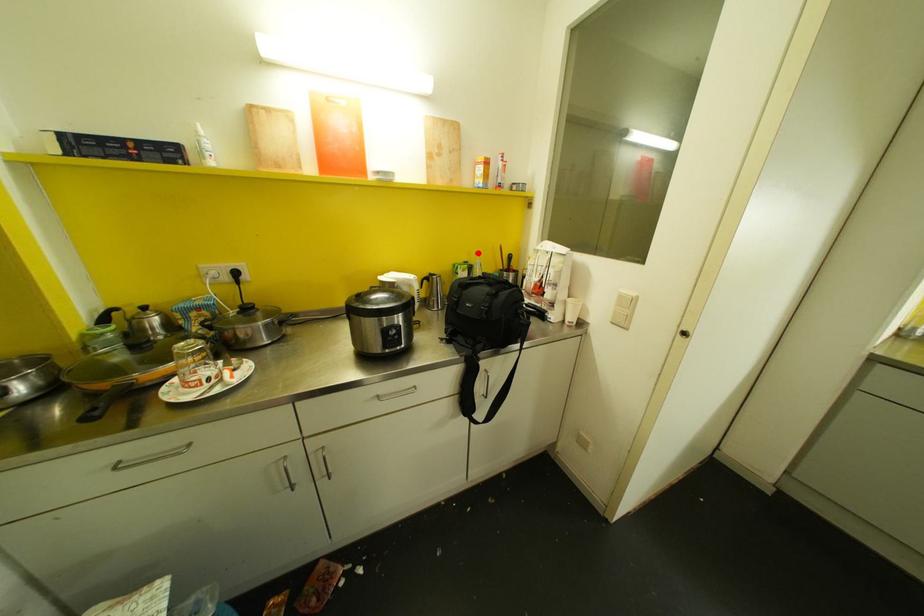
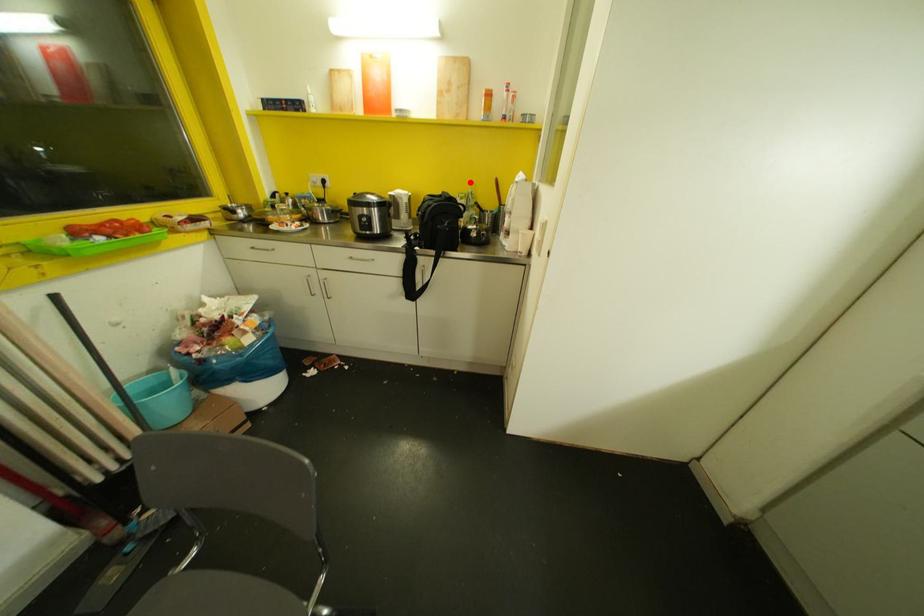
I am providing you with two images of the same scene from different viewpoints. A red point is marked on the first image and another point is marked on the second image. Does the point marked in image1 correspond to the same location as the one in image2?

Yes